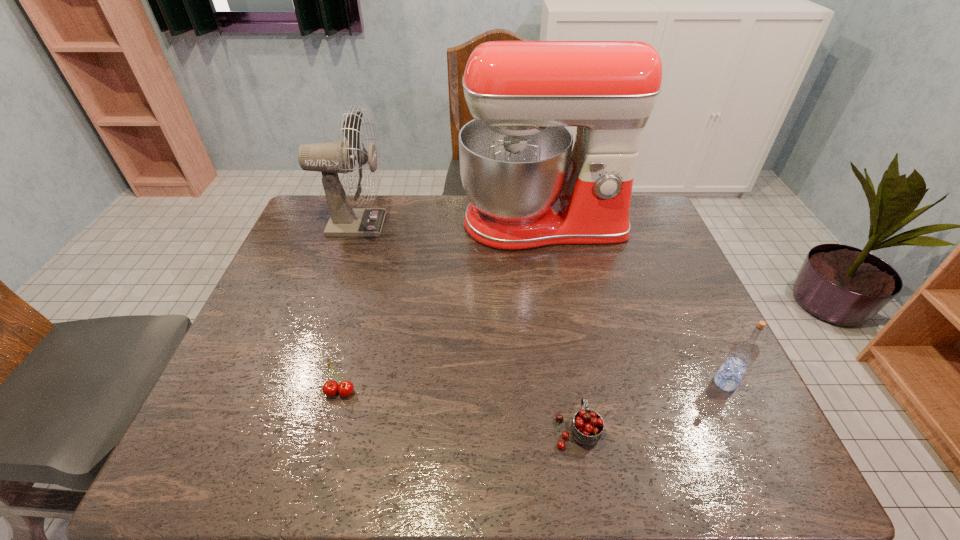
This screenshot has height=540, width=960. What are the coordinates of `free space that is in between the left cherry and the fan` in the screenshot? It's located at (347, 308).

I want to click on free space between the mixer and the fan, so click(448, 224).

At what (x,y) coordinates should I click in order to perform the action: click on vacant area that lies between the right cherry and the second tallest object. Please return your answer as a coordinate pair (x, y). Image resolution: width=960 pixels, height=540 pixels. Looking at the image, I should click on (466, 327).

In order to click on unoccupied position between the third shortest object and the second tallest object in this screenshot , I will do `click(540, 303)`.

The height and width of the screenshot is (540, 960). I want to click on free space that is in between the fan and the vodka, so [x=540, y=303].

Where is `free spot between the fan and the rightmost object`? free spot between the fan and the rightmost object is located at coordinates (540, 303).

This screenshot has height=540, width=960. I want to click on vacant space in between the nearer cherry and the fan, so click(466, 327).

Locate an element on the screen. object that is the second closest to the nearer cherry is located at coordinates (330, 388).

Locate an element on the screen. object that is the second closest to the fan is located at coordinates (330, 388).

Where is `free space in the image that satisfies the following two spatial constraints: 1. on the front-facing side of the mixer; 2. on the left side of the rightmost object`? free space in the image that satisfies the following two spatial constraints: 1. on the front-facing side of the mixer; 2. on the left side of the rightmost object is located at coordinates (571, 383).